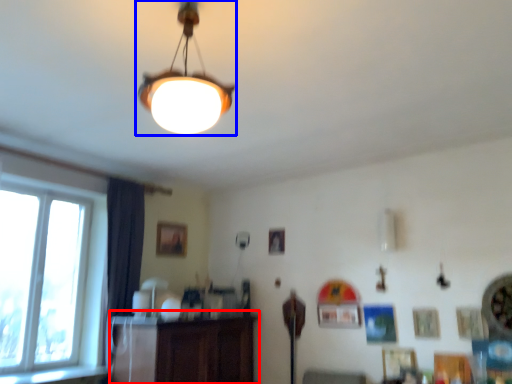
Question: Which object is further to the camera taking this photo, dresser (highlighted by a red box) or lamp (highlighted by a blue box)?

Choices:
 (A) dresser
 (B) lamp

Answer: (A)